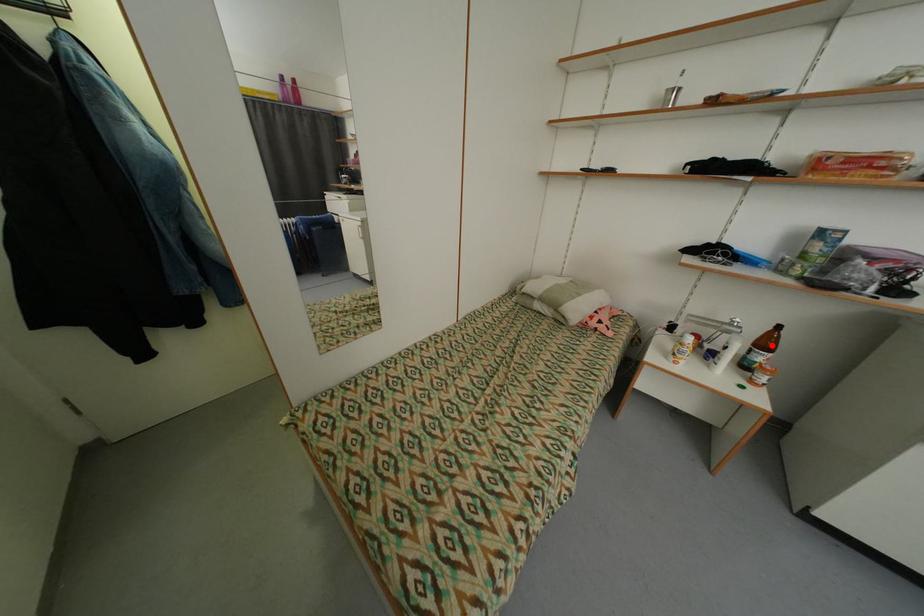
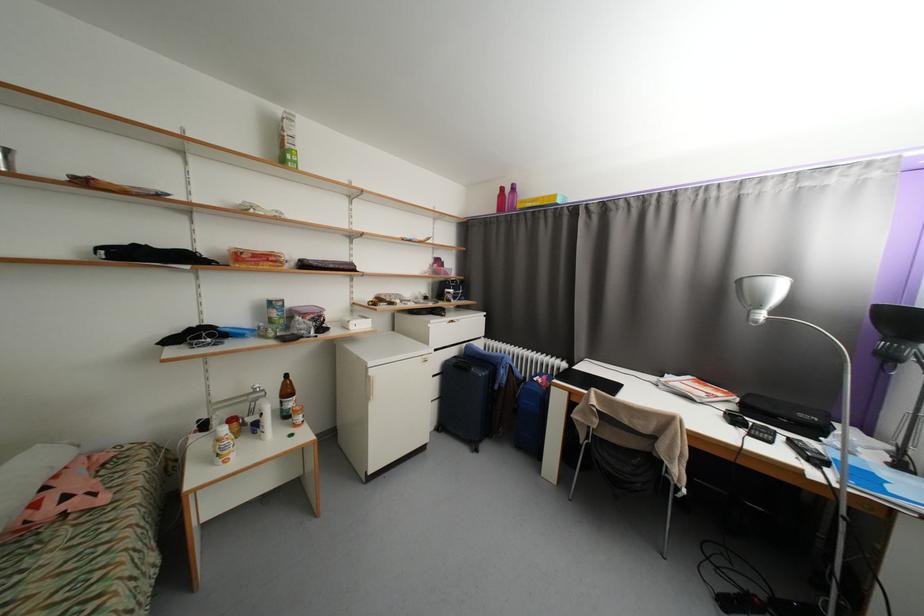
Question: I am providing you with two images of the same scene from different viewpoints. Image1 has a red point marked. In image2, the corresponding 3D location appears at what relative position? Reply with the corresponding letter.

Choices:
 (A) Closer
 (B) Farther

Answer: (A)